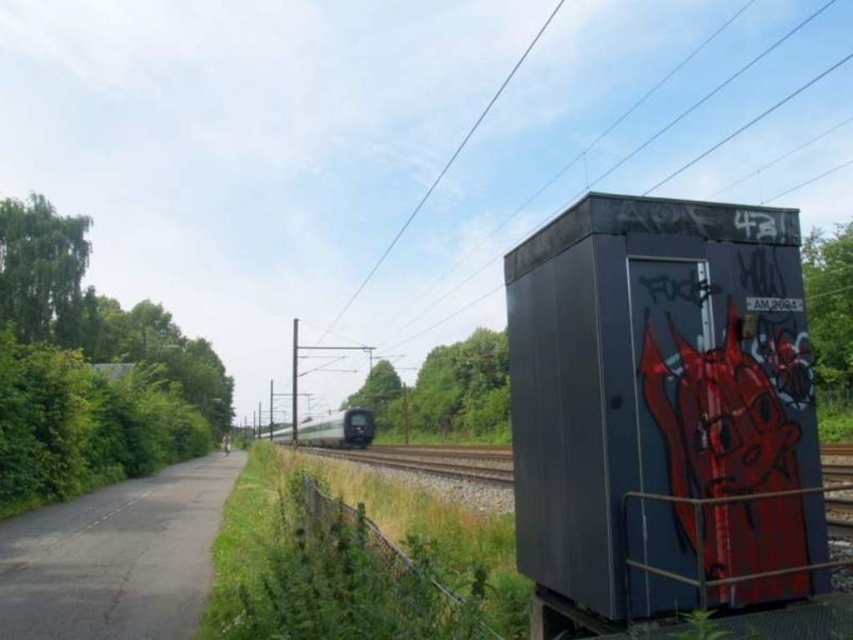
Question: Which of the following is the closest to the observer?

Choices:
 (A) smooth metal train track at center
 (B) silver metallic train at center

Answer: (A)

Question: Does smooth metal train track at center appear on the right side of silver metallic train at center?

Choices:
 (A) yes
 (B) no

Answer: (A)

Question: Does smooth metal train track at center lie behind silver metallic train at center?

Choices:
 (A) no
 (B) yes

Answer: (A)

Question: Which point appears closest to the camera in this image?

Choices:
 (A) (312, 444)
 (B) (431, 465)

Answer: (B)

Question: Does smooth metal train track at center appear on the left side of silver metallic train at center?

Choices:
 (A) no
 (B) yes

Answer: (A)